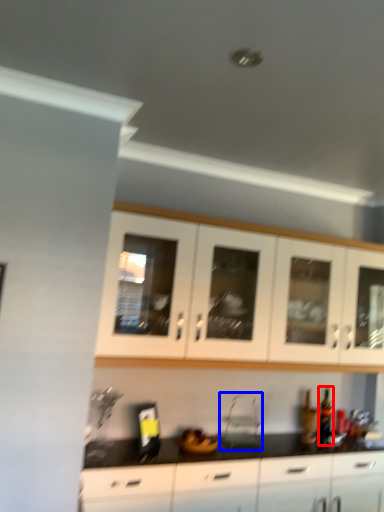
Question: Which point is further to the camera, bottle (highlighted by a red box) or appliance (highlighted by a blue box)?

Choices:
 (A) bottle
 (B) appliance

Answer: (A)